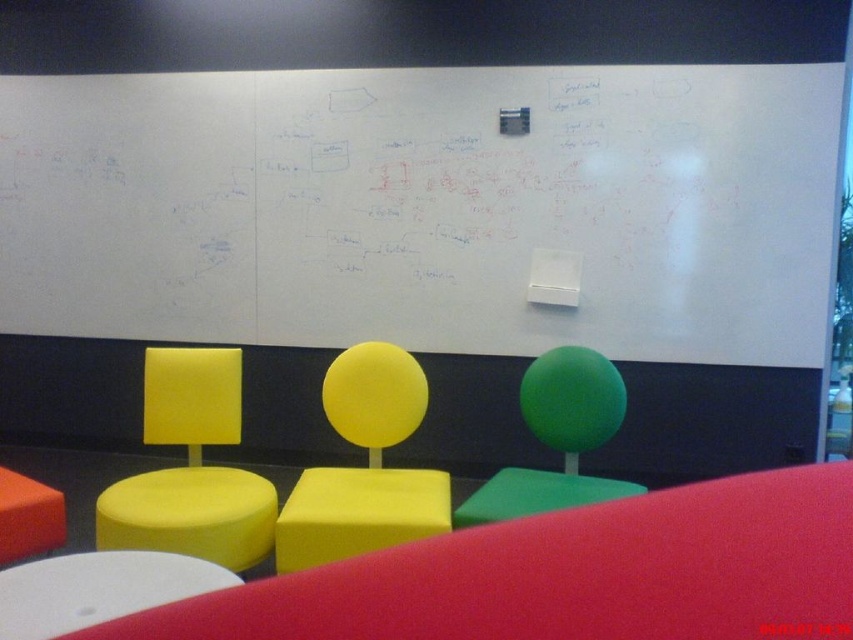
You are a person sitting on the matte orange stool at lower left. You want to write something on the whiteboard at upper center. Can you reach it without moving your stool?

The whiteboard at upper center is positioned over the matte orange stool at lower left, meaning it is above the stool. Since the stool is at lower left and the whiteboard is above it, you might be able to reach the lower portion of the whiteboard at upper center from the matte orange stool at lower left, but the upper areas may be out of reach without standing or using a tool.

You are standing in a room and want to move to the yellow matte chair at center. The minimum distance you can move is 2.5 meters. Can you reach the chair without moving more than 2.5 meters?

The distance between you and the yellow matte chair at center is 2.39 meters, which is less than 2.5 meters. Therefore, you can reach the chair without exceeding the minimum distance requirement.

You are arranging a small meeting in this space and need to position the yellow matte chair at center and the matte orange stool at lower left. According to the scene, which object is located to the right of the other?

The yellow matte chair at center is to the right of the matte orange stool at lower left.